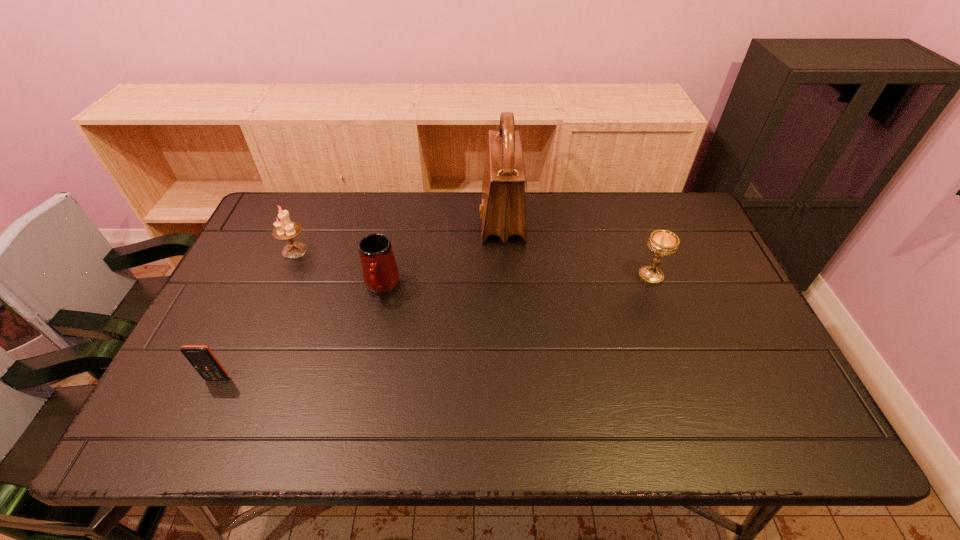
The height and width of the screenshot is (540, 960). Identify the location of blank area located 0.190m on the side of the third object from right to left with the handle. (365, 365).

This screenshot has width=960, height=540. I want to click on free space located on the back of the rightmost object, so click(623, 203).

You are a GUI agent. You are given a task and a screenshot of the screen. Output one action in this format:
    pyautogui.click(x=<x>, y=<y>)
    Task: Click on the blank space located 0.050m on the screen of the nearest object
    The image size is (960, 540).
    Given the screenshot: What is the action you would take?
    pyautogui.click(x=207, y=401)

In order to click on object at the far edge in this screenshot , I will do `click(503, 211)`.

Where is `candle holder that is at the left edge`? This screenshot has height=540, width=960. candle holder that is at the left edge is located at coordinates (x=285, y=230).

Identify the location of cellular telephone located at the left edge. This screenshot has width=960, height=540. (201, 357).

Where is `vacant space at the far edge`? Image resolution: width=960 pixels, height=540 pixels. vacant space at the far edge is located at coordinates tap(390, 225).

This screenshot has height=540, width=960. Find the location of `vacant region at the near edge of the desktop`. vacant region at the near edge of the desktop is located at coordinates (506, 446).

Locate an element on the screen. The image size is (960, 540). blank area at the right edge is located at coordinates (725, 394).

What are the coordinates of `vacant region at the near right corner` in the screenshot? It's located at (776, 416).